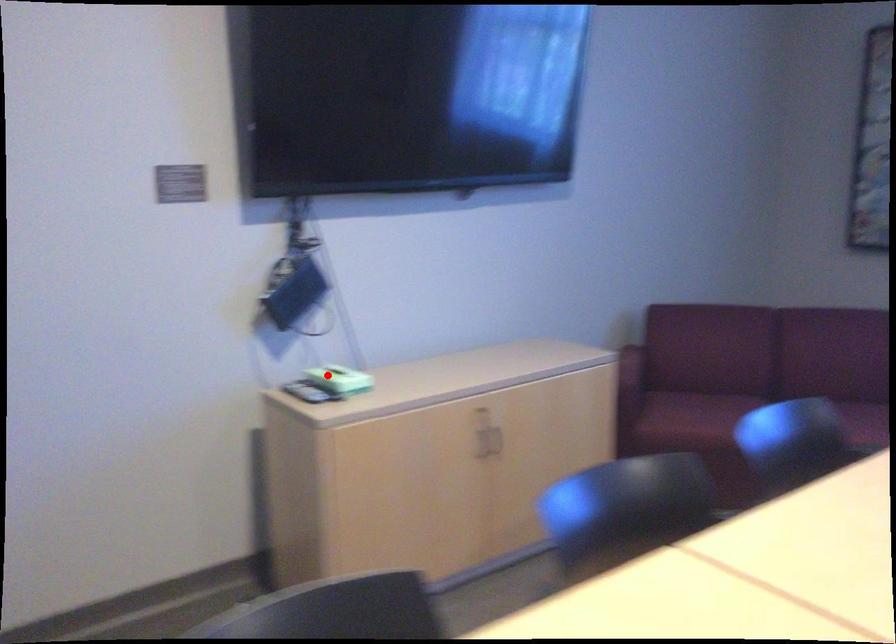
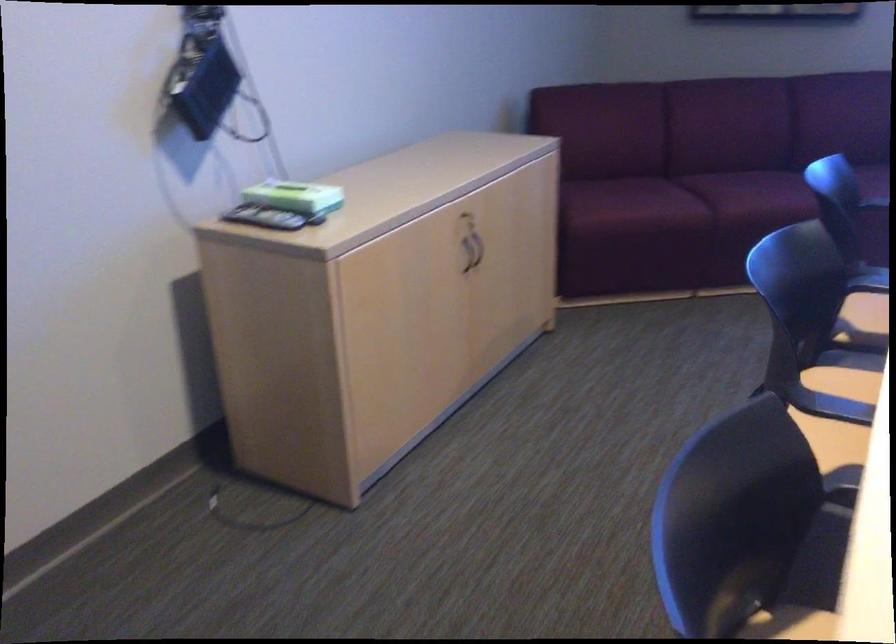
Question: I am providing you with two images of the same scene from different viewpoints. Given a red point in image1, look at the same physical point in image2. Is it:

Choices:
 (A) Closer to the viewpoint
 (B) Farther from the viewpoint

Answer: (A)